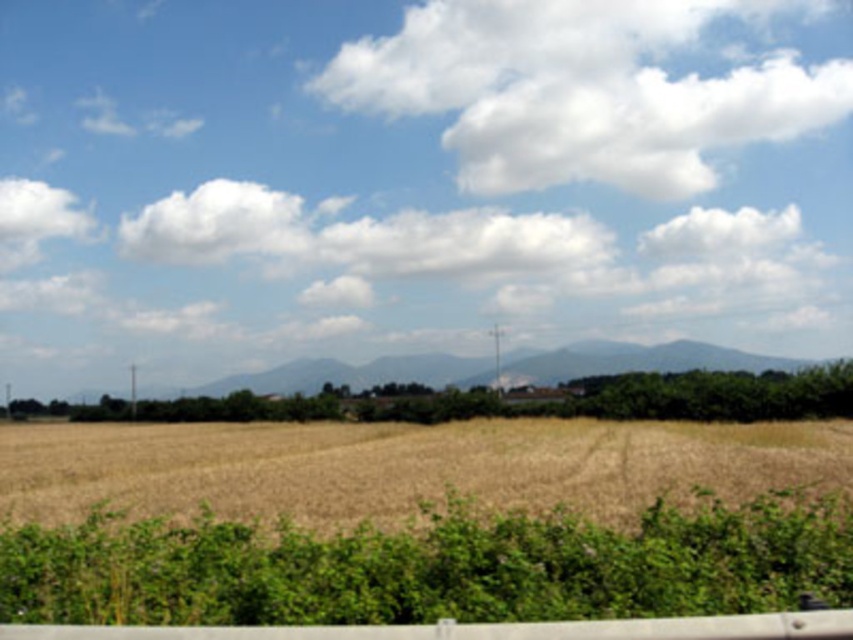
Does golden dry wheat field at center have a lesser height compared to white fluffy cloud at upper center?

Correct, golden dry wheat field at center is not as tall as white fluffy cloud at upper center.

Between golden dry wheat field at center and white fluffy cloud at upper center, which one is positioned lower?

golden dry wheat field at center is lower down.

Where is `golden dry wheat field at center`? golden dry wheat field at center is located at coordinates (405, 467).

Where is `golden dry wheat field at center`? golden dry wheat field at center is located at coordinates (405, 467).